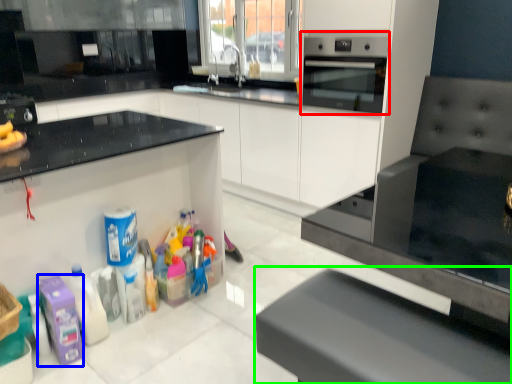
Question: Which object is positioned closest to home appliance (highlighted by a red box)? Select from cleaning product (highlighted by a blue box) and furniture (highlighted by a green box).

Choices:
 (A) cleaning product
 (B) furniture

Answer: (B)